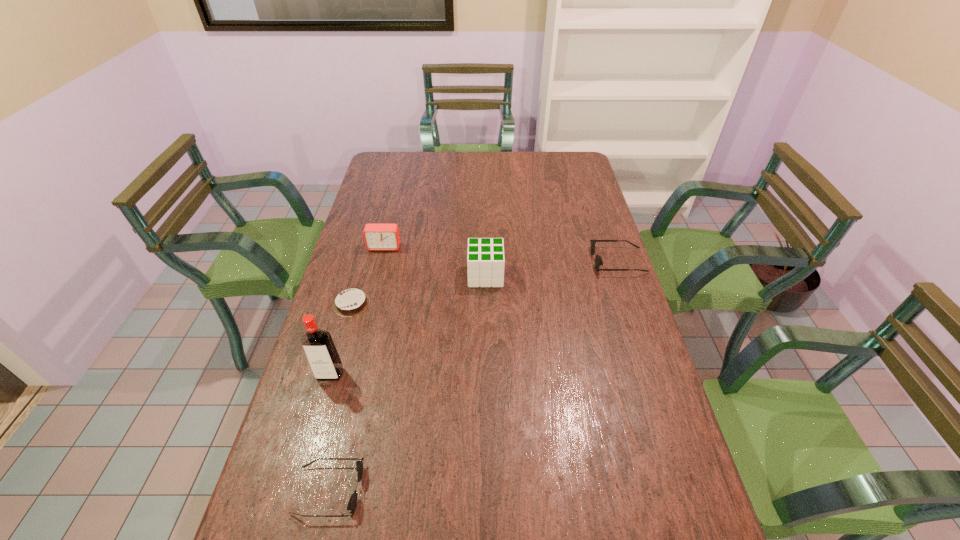
Locate an element on the screen. free space located on the front and back of the vodka is located at coordinates (311, 441).

You are a GUI agent. You are given a task and a screenshot of the screen. Output one action in this format:
    pyautogui.click(x=<x>, y=<y>)
    Task: Click on the object at the near edge
    This screenshot has height=540, width=960.
    Given the screenshot: What is the action you would take?
    pyautogui.click(x=352, y=503)

At what (x,y) coordinates should I click in order to perform the action: click on sunglasses that is positioned at the left edge. Please return your answer as a coordinate pair (x, y). This screenshot has width=960, height=540. Looking at the image, I should click on (352, 503).

You are a GUI agent. You are given a task and a screenshot of the screen. Output one action in this format:
    pyautogui.click(x=<x>, y=<y>)
    Task: Click on the alarm clock located in the left edge section of the desktop
    The image size is (960, 540).
    Given the screenshot: What is the action you would take?
    pos(378,237)

What are the coordinates of `chocolate cake present at the left edge` in the screenshot? It's located at (352, 302).

You are a GUI agent. You are given a task and a screenshot of the screen. Output one action in this format:
    pyautogui.click(x=<x>, y=<y>)
    Task: Click on the vodka that is at the left edge
    The width and height of the screenshot is (960, 540).
    Given the screenshot: What is the action you would take?
    pyautogui.click(x=320, y=350)

At what (x,y) coordinates should I click in order to perform the action: click on object present at the right edge. Please return your answer as a coordinate pair (x, y). The height and width of the screenshot is (540, 960). Looking at the image, I should click on (598, 261).

You are a GUI agent. You are given a task and a screenshot of the screen. Output one action in this format:
    pyautogui.click(x=<x>, y=<y>)
    Task: Click on the object that is at the near left corner
    The height and width of the screenshot is (540, 960).
    Given the screenshot: What is the action you would take?
    pyautogui.click(x=352, y=503)

Find the location of a particular element. This screenshot has height=540, width=960. vacant point at the far edge is located at coordinates (473, 155).

Locate an element on the screen. This screenshot has width=960, height=540. vacant position at the near edge of the desktop is located at coordinates (481, 512).